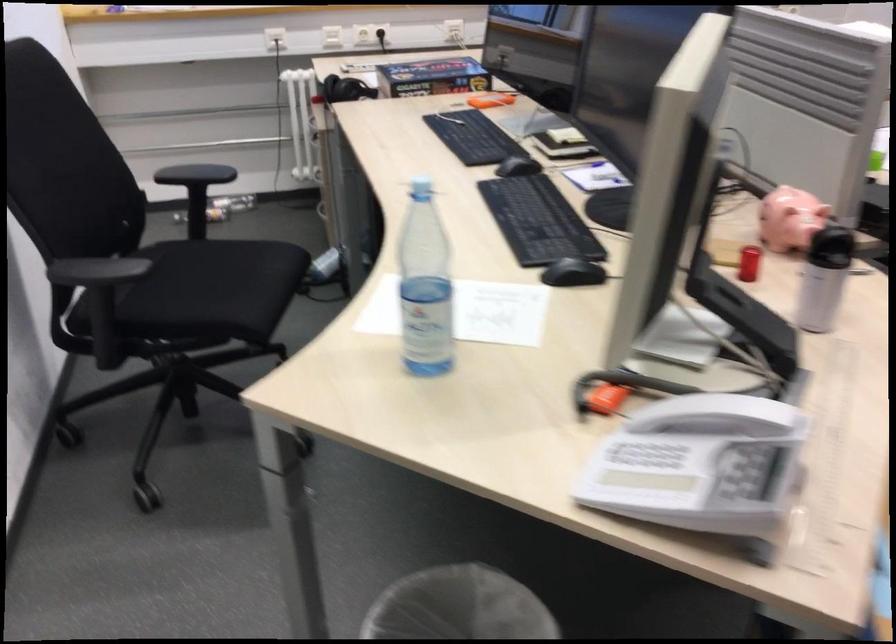
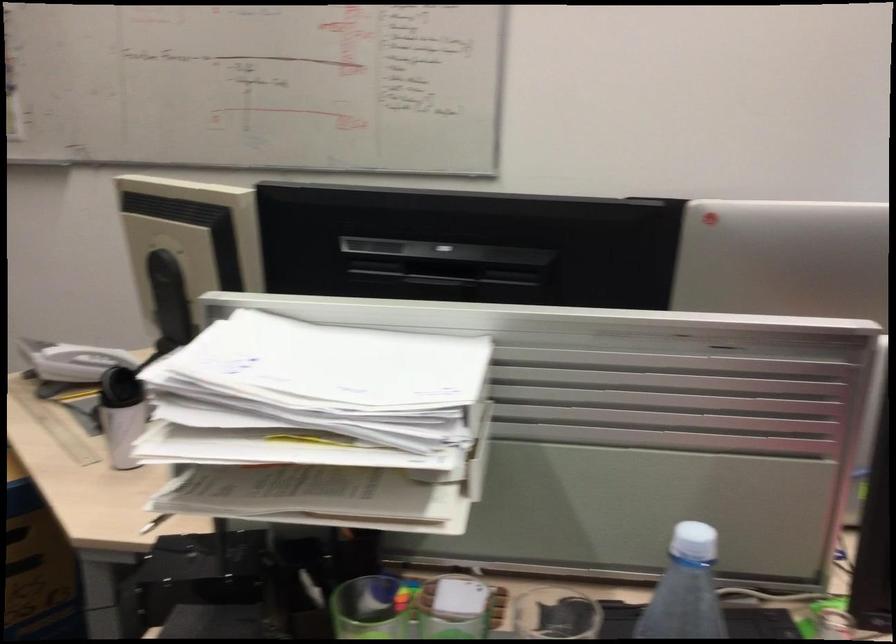
Locate, in the second image, the point that corresponds to pixel 824 173 in the first image.

(367, 609)